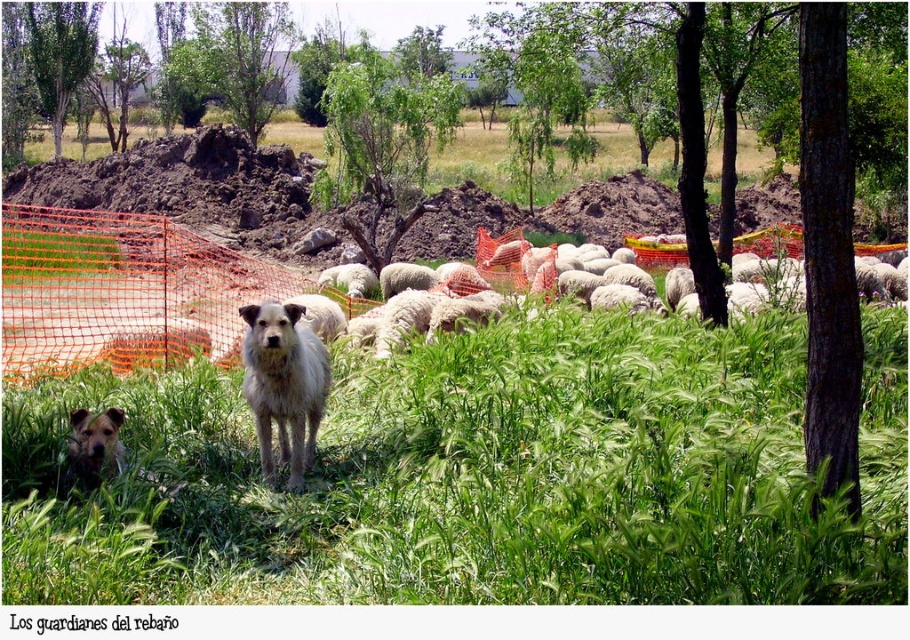
You are a farmer checking the safety of your animals. You notice the orange mesh fence at center and the white woolly sheep at center in the image. Based on their positions, is the fence providing adequate protection between the sheep and the construction site?

The orange mesh fence at center is located below the white woolly sheep at center, meaning the fence is positioned lower than the sheep. This might leave parts of the sheep exposed to potential hazards from the construction site, so the fence may not be providing adequate protection.

You are standing at point (x=488, y=243) and want to walk to point (x=835, y=593). Which direction should you move to reach your destination?

You should move forward because point (x=835, y=593) is in front of point (x=488, y=243).

You are a photographer trying to capture the white shaggy dog at center. However, the green grassy at center is blocking your view. Can you move the grass to see the dog better?

The green grassy at center is in front of the white shaggy dog at center, so moving the grass would allow you to see the dog more clearly.